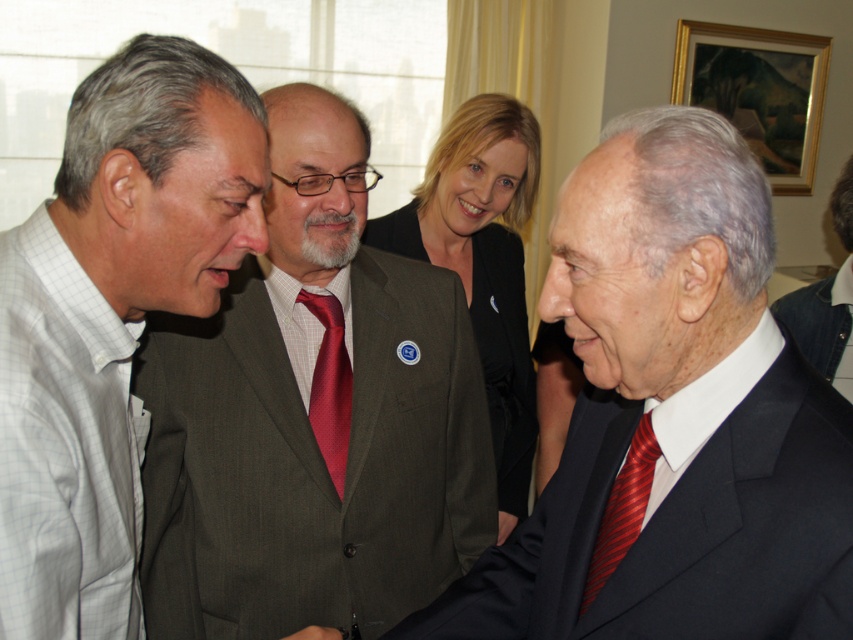
Is shiny red tie at center below red striped tie at right?

No, shiny red tie at center is not below red striped tie at right.

Between shiny red tie at center and red striped tie at right, which one appears on the left side from the viewer's perspective?

shiny red tie at center is more to the left.

Is point (347, 385) behind point (641, 481)?

That is True.

You are a GUI agent. You are given a task and a screenshot of the screen. Output one action in this format:
    pyautogui.click(x=<x>, y=<y>)
    Task: Click on the shiny red tie at center
    The height and width of the screenshot is (640, 853).
    Given the screenshot: What is the action you would take?
    pyautogui.click(x=329, y=385)

Is matte gray suit at center to the left of red striped tie at right from the viewer's perspective?

Correct, you'll find matte gray suit at center to the left of red striped tie at right.

Does point (332, 566) come in front of point (587, 595)?

No, (332, 566) is further to viewer.

Where is `matte gray suit at center`? The height and width of the screenshot is (640, 853). matte gray suit at center is located at coordinates (312, 419).

Find the location of `matte gray suit at center`. matte gray suit at center is located at coordinates (312, 419).

Is point (448, 196) positioned before point (311, 632)?

No, it is not.

Is point (492, 404) closer to camera compared to point (305, 632)?

No, it is not.

You are a GUI agent. You are given a task and a screenshot of the screen. Output one action in this format:
    pyautogui.click(x=<x>, y=<y>)
    Task: Click on the matte black blazer at center
    The width and height of the screenshot is (853, 640).
    Given the screenshot: What is the action you would take?
    483,262